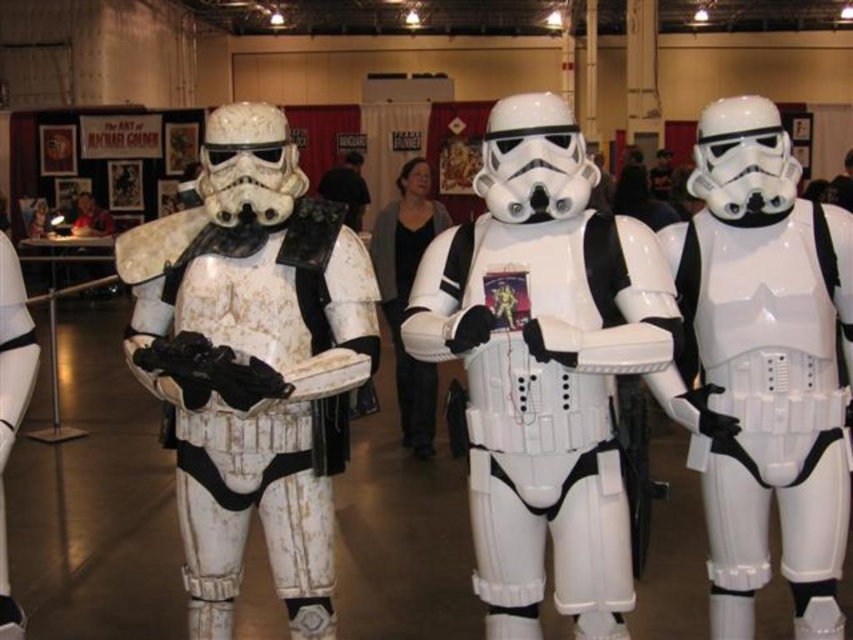
Question: Can you confirm if white matte helmet at center is positioned to the left of matte white helmet at center?

Choices:
 (A) yes
 (B) no

Answer: (B)

Question: Estimate the real-world distances between objects in this image. Which object is farther from the white matte stormtrooper armor at center?

Choices:
 (A) white matte helmet at center
 (B) matte white helmet at center
 (C) white plastic stormtrooper at center
 (D) black matte shirt at center

Answer: (B)

Question: Which of the following is the closest to the observer?

Choices:
 (A) white plastic stormtrooper at center
 (B) white matte helmet at center

Answer: (A)

Question: Can you confirm if white plastic stormtrooper at center is positioned to the right of matte white helmet at center?

Choices:
 (A) yes
 (B) no

Answer: (A)

Question: From the image, what is the correct spatial relationship of white glossy stormtrooper at center in relation to white matte helmet at center?

Choices:
 (A) right
 (B) left

Answer: (A)

Question: Which point is farther to the camera?

Choices:
 (A) (352, 195)
 (B) (624, 563)
 (C) (200, 564)
 (D) (74, 202)

Answer: (D)